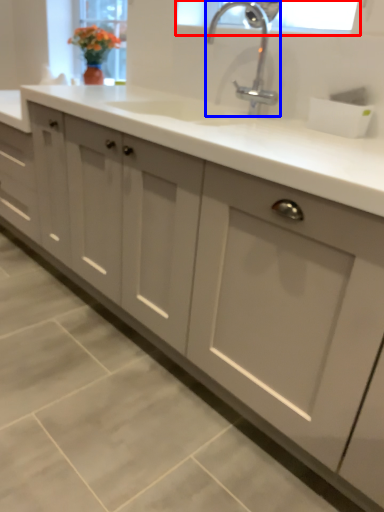
Question: Which point is further to the camera, window screen (highlighted by a red box) or tap (highlighted by a blue box)?

Choices:
 (A) window screen
 (B) tap

Answer: (A)